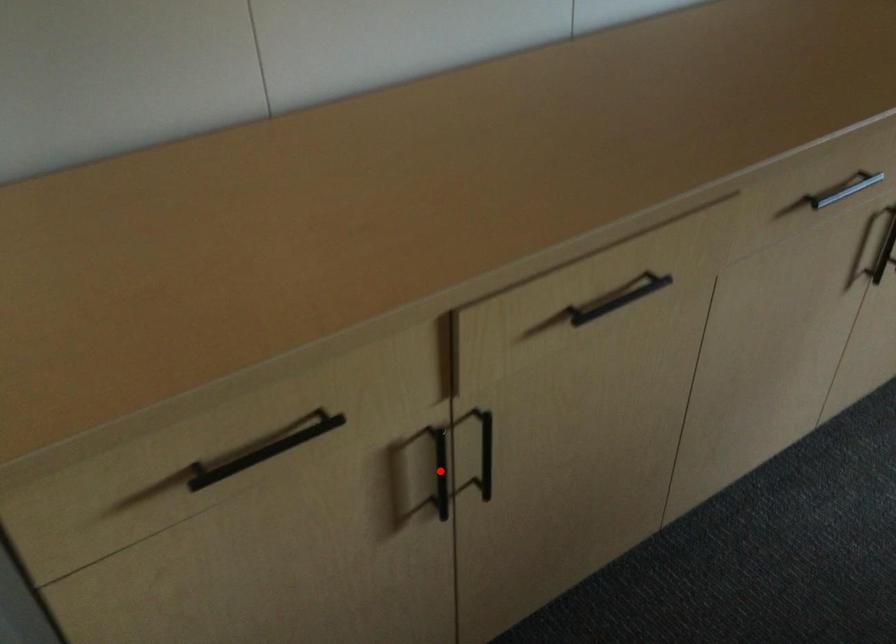
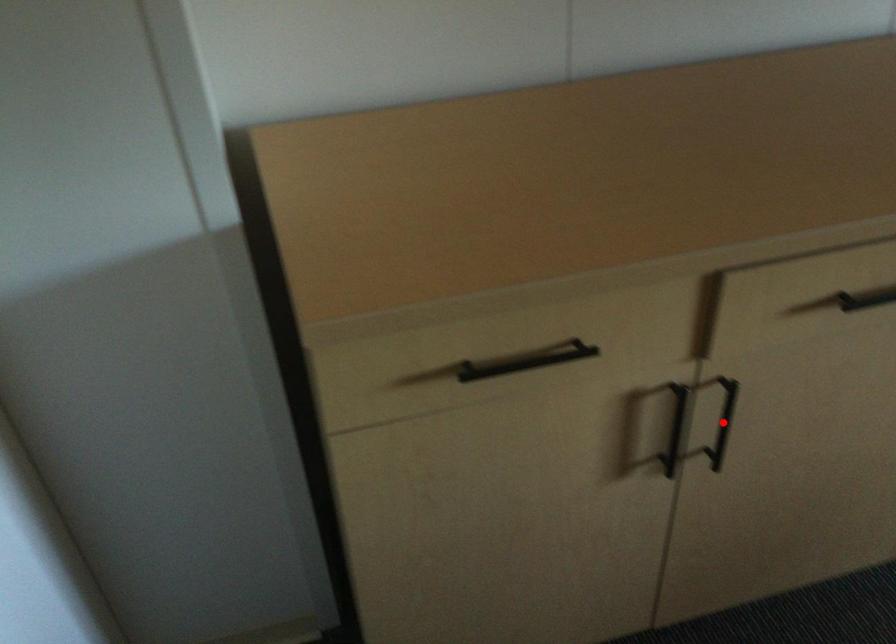
I am providing you with two images of the same scene from different viewpoints. A red point is marked on the first image and another point is marked on the second image. Do the highlighted points in image1 and image2 indicate the same real-world spot?

No